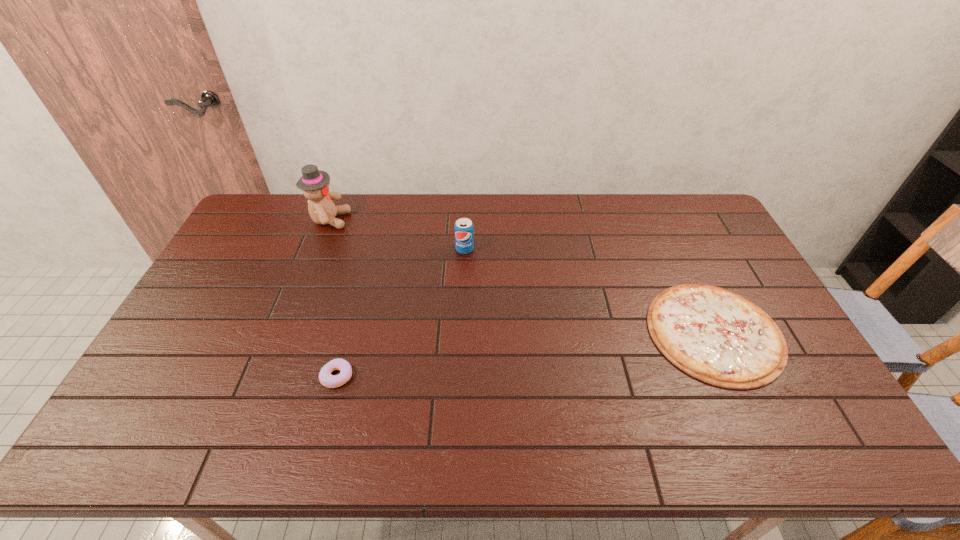
Locate an element on the screen. free space between the second object from right to left and the pizza is located at coordinates (589, 291).

The width and height of the screenshot is (960, 540). I want to click on vacant point located between the third object from right to left and the farthest object, so [x=333, y=298].

This screenshot has height=540, width=960. In order to click on empty space between the doughnut and the shortest object in this screenshot , I will do `click(526, 354)`.

Locate an element on the screen. vacant region between the leftmost object and the rightmost object is located at coordinates (522, 276).

I want to click on free space between the second shortest object and the third nearest object, so click(x=401, y=313).

Locate an element on the screen. Image resolution: width=960 pixels, height=540 pixels. vacant point located between the farthest object and the shortest object is located at coordinates (522, 276).

You are a GUI agent. You are given a task and a screenshot of the screen. Output one action in this format:
    pyautogui.click(x=<x>, y=<y>)
    Task: Click on the blank region between the third tallest object and the rightmost object
    This screenshot has width=960, height=540.
    Given the screenshot: What is the action you would take?
    click(526, 354)

Locate an element on the screen. The width and height of the screenshot is (960, 540). vacant area that lies between the third object from right to left and the rightmost object is located at coordinates (526, 354).

The height and width of the screenshot is (540, 960). I want to click on object that is the third closest one to the shortest object, so click(x=314, y=183).

Where is `object that ranks as the third closest to the second object from left to right`? This screenshot has width=960, height=540. object that ranks as the third closest to the second object from left to right is located at coordinates (717, 336).